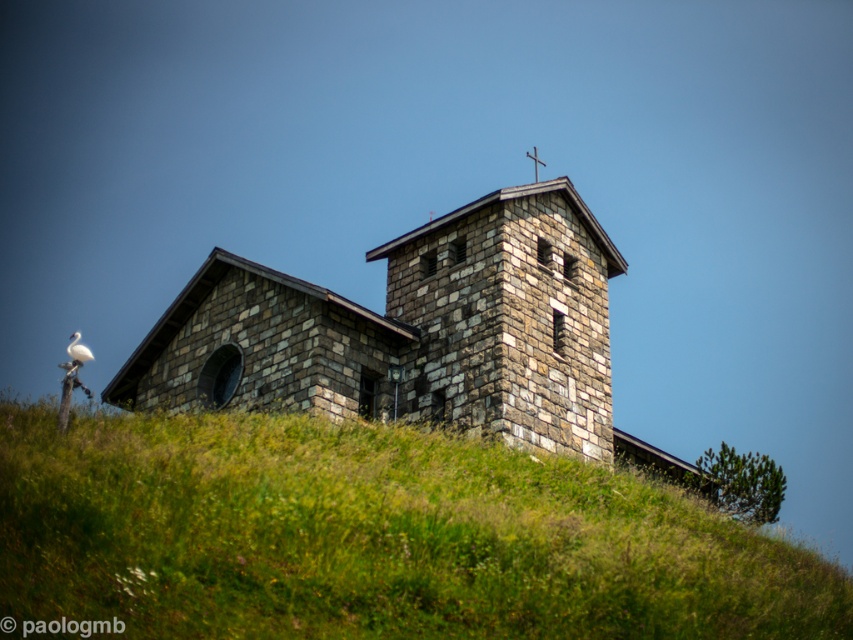
Who is higher up, green grassy hillside at center or white feathered bird at upper left?

Positioned higher is white feathered bird at upper left.

Is green grassy hillside at center above white feathered bird at upper left?

Incorrect, green grassy hillside at center is not positioned above white feathered bird at upper left.

Does point (392, 618) lie in front of point (91, 355)?

That is True.

Where is `green grassy hillside at center`? green grassy hillside at center is located at coordinates pyautogui.click(x=372, y=538).

Between point (125, 458) and point (593, 444), which one is positioned behind?

Positioned behind is point (593, 444).

Who is shorter, green grassy hillside at center or stone church at center?

green grassy hillside at center is shorter.

What do you see at coordinates (372, 538) in the screenshot? I see `green grassy hillside at center` at bounding box center [372, 538].

Identify the location of green grassy hillside at center. The height and width of the screenshot is (640, 853). (372, 538).

Which is above, stone church at center or white feathered bird at upper left?

stone church at center

Does point (541, 301) come farther from viewer compared to point (90, 353)?

No.

I want to click on stone church at center, so click(416, 333).

You are a GUI agent. You are given a task and a screenshot of the screen. Output one action in this format:
    pyautogui.click(x=<x>, y=<y>)
    Task: Click on the stone church at center
    
    Given the screenshot: What is the action you would take?
    pyautogui.click(x=416, y=333)